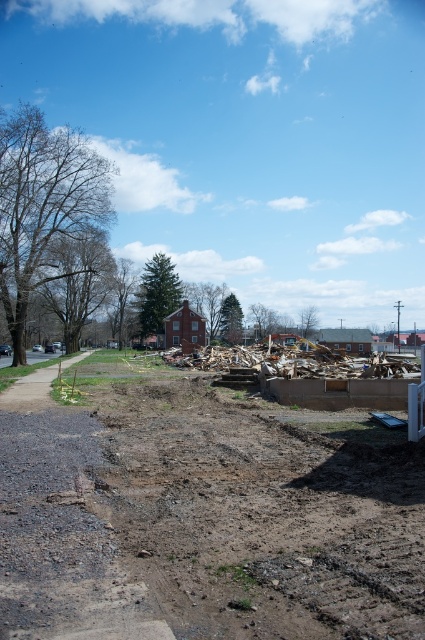
Who is taller, dull brown dirt at center or broken wood debris at center?

Standing taller between the two is broken wood debris at center.

Between point (193, 582) and point (237, 358), which one is positioned in front?

Point (193, 582) is in front.

Locate an element on the screen. dull brown dirt at center is located at coordinates (201, 513).

Between dull brown dirt at center and gravel at left, which one has less height?

dull brown dirt at center is shorter.

Between dull brown dirt at center and gravel at left, which one has more height?

gravel at left

Locate an element on the screen. The height and width of the screenshot is (640, 425). dull brown dirt at center is located at coordinates (201, 513).

Where is `dull brown dirt at center`? Image resolution: width=425 pixels, height=640 pixels. dull brown dirt at center is located at coordinates (201, 513).

Who is taller, broken wood debris at center or gravel at left?

With more height is gravel at left.

Consider the image. Which is more to the right, broken wood debris at center or gravel at left?

broken wood debris at center

Locate an element on the screen. broken wood debris at center is located at coordinates (198, 358).

Locate an element on the screen. The width and height of the screenshot is (425, 640). broken wood debris at center is located at coordinates (198, 358).